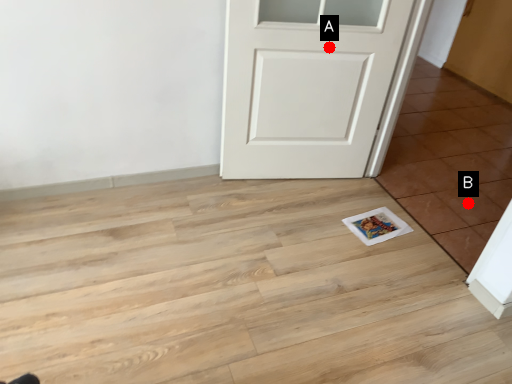
Question: Two points are circled on the image, labeled by A and B beside each circle. Which point is farther to the camera?

Choices:
 (A) A is further
 (B) B is further

Answer: (B)